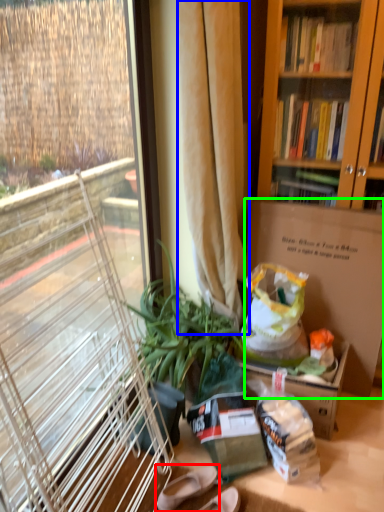
Question: Estimate the real-world distances between objects in this image. Which object is farther from footwear (highlighted by a red box), curtain (highlighted by a blue box) or box (highlighted by a green box)?

Choices:
 (A) curtain
 (B) box

Answer: (A)